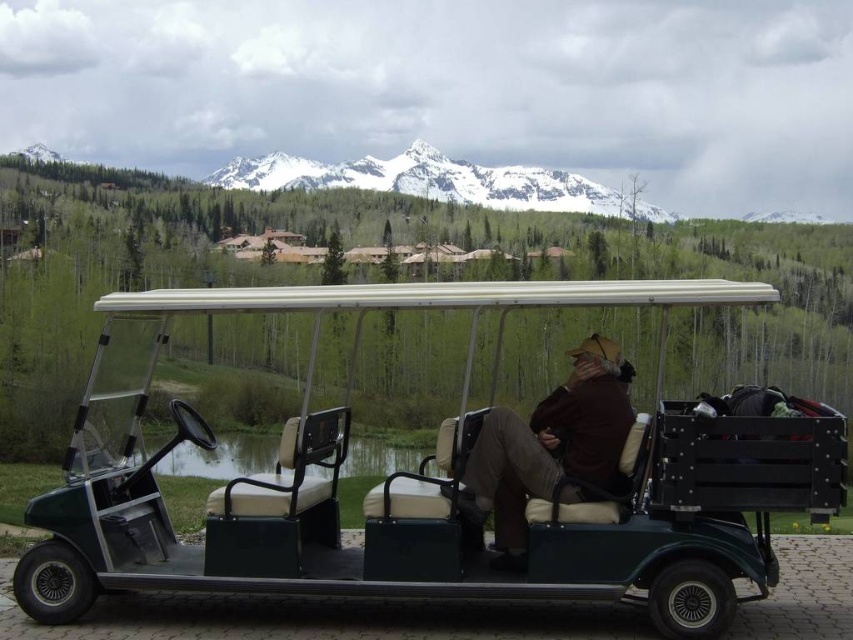
You are a photographer trying to capture a clear shot of the green matte golf cart at center and the brown leather jacket at center. Since you want both subjects in focus, which one should you adjust your camera focus on first?

The green matte golf cart at center is closer to the viewer than the brown leather jacket at center, so you should focus on the green matte golf cart at center first to ensure both are in focus.

You are a tour guide planning a route for visitors. The green matte golf cart at center can travel at 10 mph. How long would it take to reach the snowy peak at upper center from the golf cart at center?

The distance between the green matte golf cart at center and the snowy peak at upper center is 753.94 feet. Converting this to miles, it is approximately 0.143 miles. At a speed of 10 mph, the time taken would be about 0.143 miles divided by 10 mph, which equals roughly 0.0143 hours. Converting hours to minutes by multiplying by 60, this is approximately 0.86 minutes, or about 52 seconds. Therefore, it would take approximately 52 seconds to reach the snowy peak at upper center from the green matte golf cart